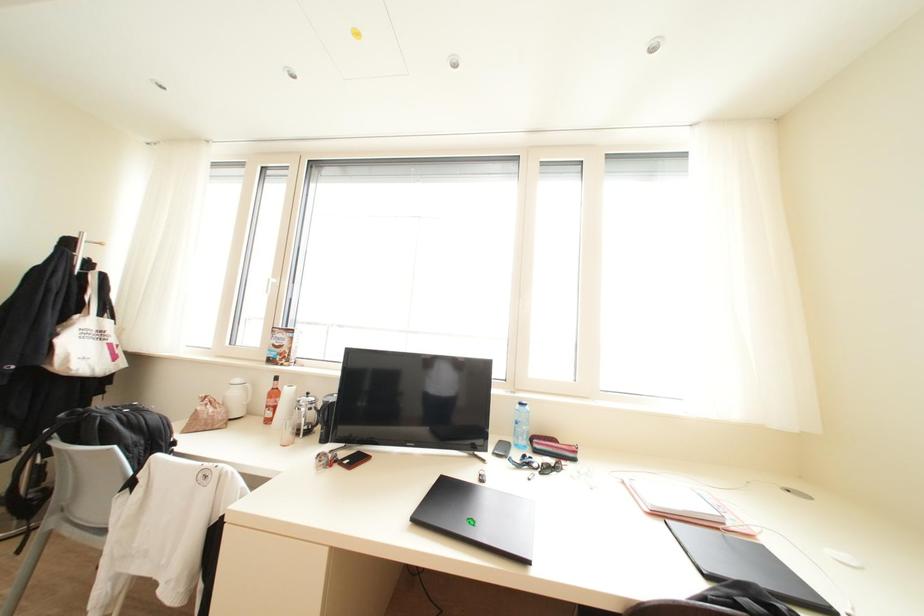
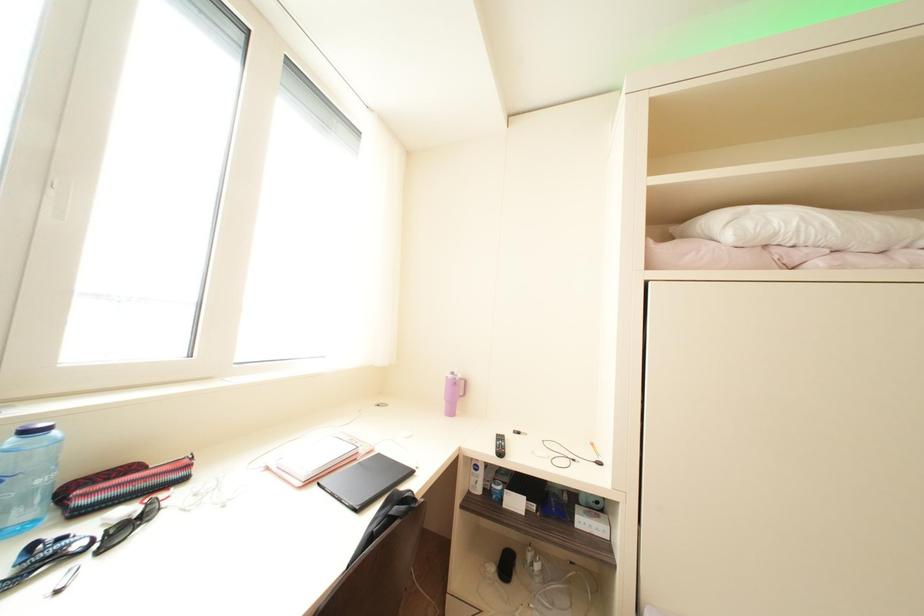
Question: Based on the continuous images, in which direction is the camera rotating? Reply with the corresponding letter.

Choices:
 (A) Left
 (B) Right
 (C) Up
 (D) Down

Answer: (B)